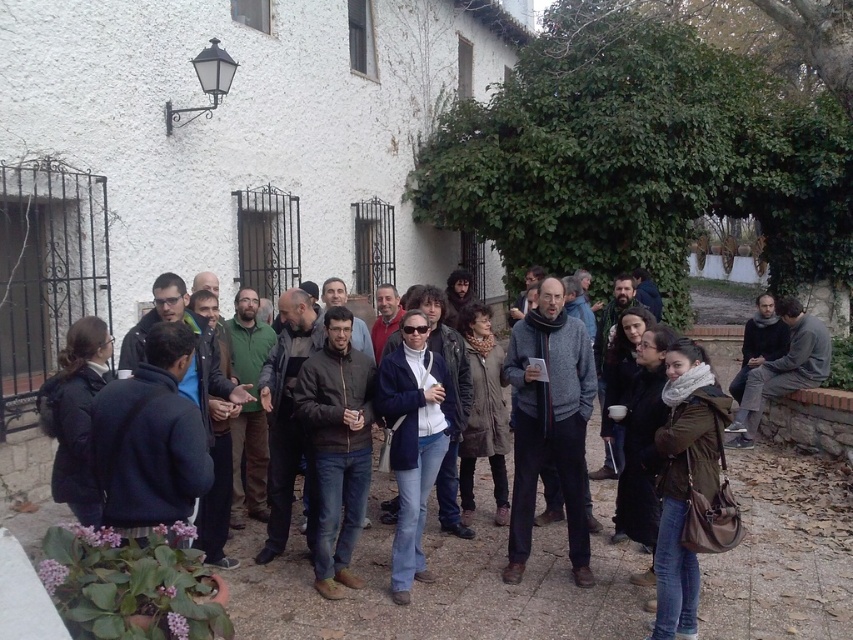
Between dark brown leather jacket at center and dark gray sweater at center, which one has less height?

With less height is dark gray sweater at center.

Is dark brown leather jacket at center smaller than dark gray sweater at center?

No.

The height and width of the screenshot is (640, 853). Identify the location of dark brown leather jacket at center. (450, 600).